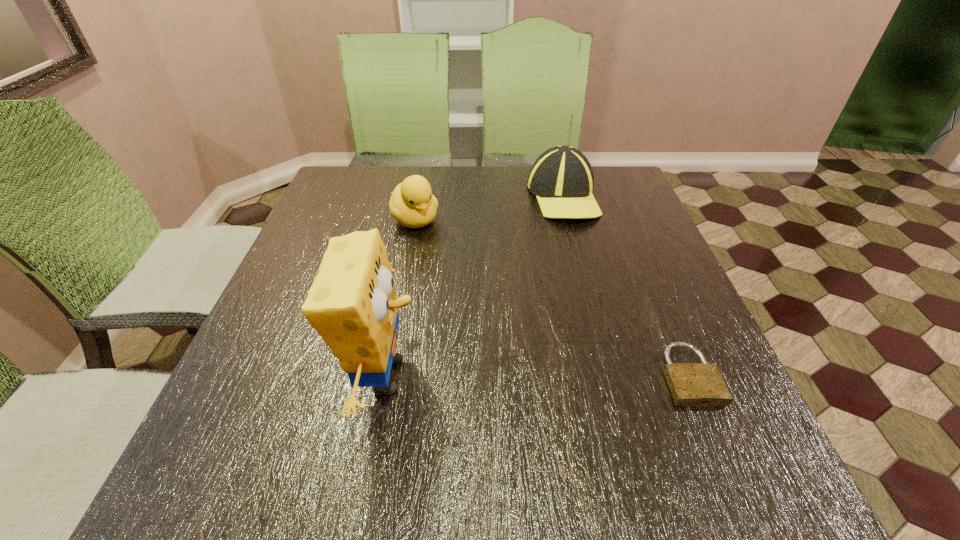
Locate an element on the screen. The image size is (960, 540). free space on the desktop that is between the tallest object and the shortest object and is positioned with the brim of the second object from right to left facing forward is located at coordinates (568, 375).

In order to click on free spot on the desktop that is between the tallest object and the rightmost object and is positioned on the front-facing side of the duck in this screenshot , I will do (x=558, y=375).